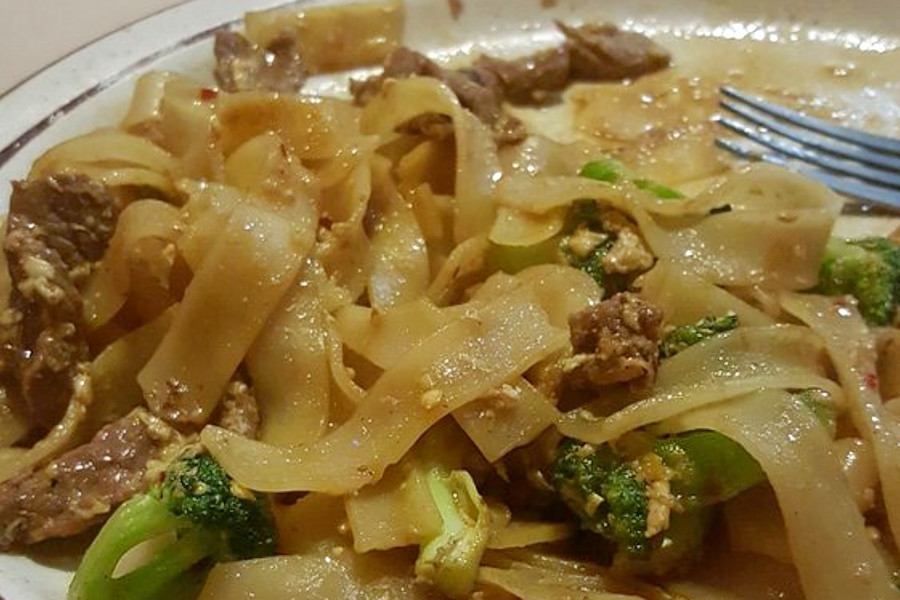
The image size is (900, 600). What are the coordinates of `light tan table surface top` in the screenshot? It's located at (36, 23).